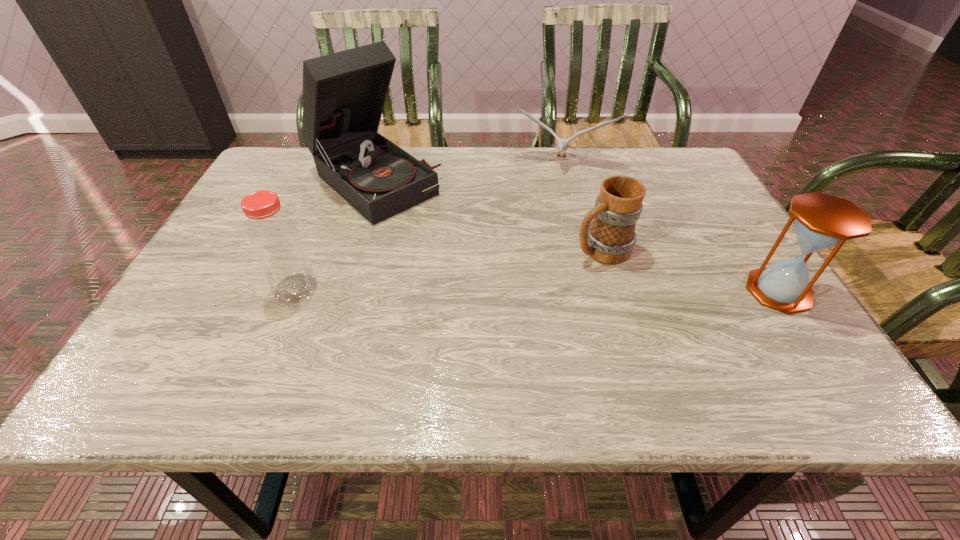
Where is `vacant region located on the side of the mug with the handle`? This screenshot has height=540, width=960. vacant region located on the side of the mug with the handle is located at coordinates (512, 291).

This screenshot has height=540, width=960. In order to click on vacant area situated 0.380m on the side of the mug with the handle in this screenshot , I will do `click(426, 333)`.

In order to click on free space located on the side of the mug with the handle in this screenshot , I will do `click(527, 284)`.

Image resolution: width=960 pixels, height=540 pixels. In order to click on vacant region located on the front-facing side of the tallest object in this screenshot , I will do `click(461, 252)`.

You are a GUI agent. You are given a task and a screenshot of the screen. Output one action in this format:
    pyautogui.click(x=<x>, y=<y>)
    Task: Click on the free point located on the front-facing side of the tallest object
    The width and height of the screenshot is (960, 540).
    Given the screenshot: What is the action you would take?
    pyautogui.click(x=484, y=271)

What are the coordinates of `vacant space located 0.090m on the front-facing side of the tallest object` in the screenshot? It's located at (434, 231).

Where is `gull that is at the far edge`? This screenshot has height=540, width=960. gull that is at the far edge is located at coordinates (562, 144).

The width and height of the screenshot is (960, 540). In order to click on phonograph_record that is at the far edge in this screenshot , I will do `click(344, 93)`.

Locate an element on the screen. object that is at the left edge is located at coordinates (344, 93).

I want to click on object present at the right edge, so click(822, 221).